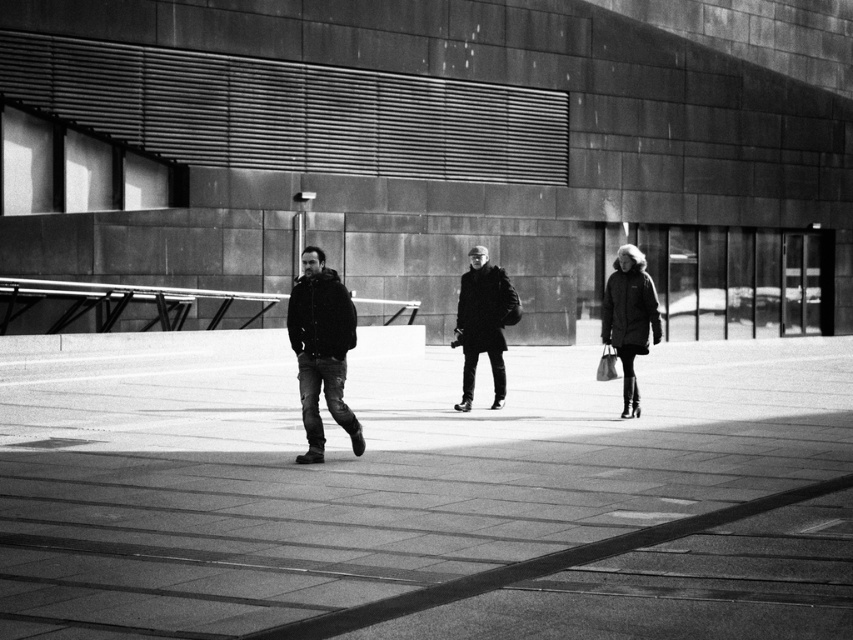
Is dark gray jeans at center to the left of black matte coat at center from the viewer's perspective?

Answer: Indeed, dark gray jeans at center is positioned on the left side of black matte coat at center.

In the scene shown: Is the position of dark gray jeans at center less distant than that of black matte coat at center?

Yes.

Does point (323, 356) lie behind point (473, 294)?

No, it is not.

In order to click on dark gray jeans at center in this screenshot , I will do `click(321, 349)`.

Is smooth concrete pavement at center behind dark gray jeans at center?

No.

Does smooth concrete pavement at center have a larger size compared to dark gray jeans at center?

Correct, smooth concrete pavement at center is larger in size than dark gray jeans at center.

Where is `smooth concrete pavement at center`? Image resolution: width=853 pixels, height=640 pixels. smooth concrete pavement at center is located at coordinates (363, 468).

Find the location of `smooth concrete pavement at center`. smooth concrete pavement at center is located at coordinates (363, 468).

Which is behind, point (259, 525) or point (492, 372)?

The point (492, 372) is more distant.

Find the location of a particular element. This screenshot has width=853, height=640. smooth concrete pavement at center is located at coordinates (363, 468).

Where is `smooth concrete pavement at center`? This screenshot has width=853, height=640. smooth concrete pavement at center is located at coordinates (363, 468).

Where is `smooth concrete pavement at center`? The image size is (853, 640). smooth concrete pavement at center is located at coordinates (363, 468).